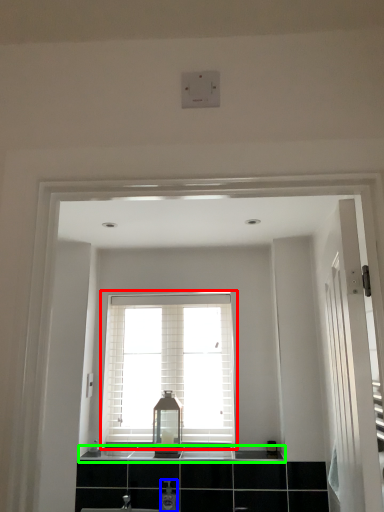
Question: Which is nearer to the window (highlighted by a red box)? toiletry (highlighted by a blue box) or counter top (highlighted by a green box).

Choices:
 (A) toiletry
 (B) counter top

Answer: (B)